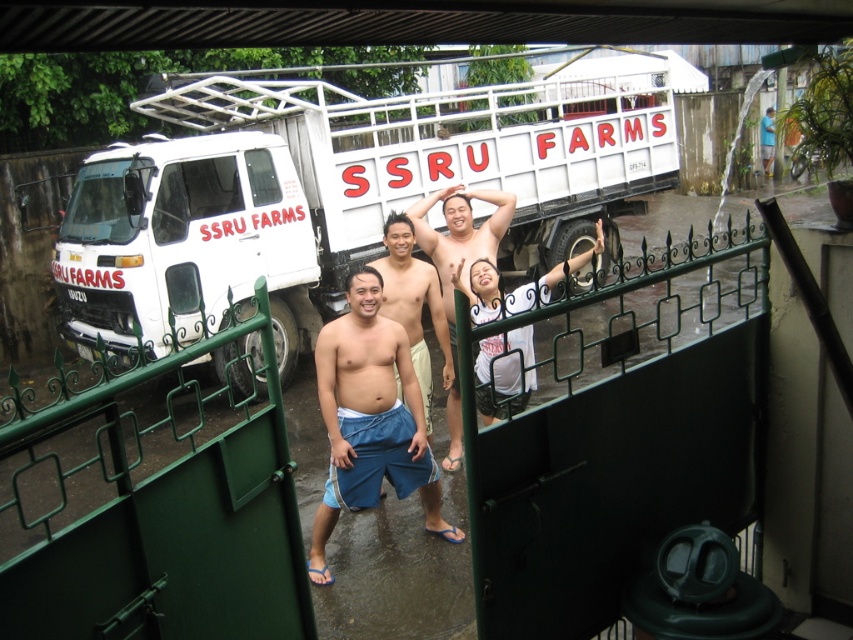
From the picture: Between white matte truck at upper center and white cotton shirt at center, which one appears on the left side from the viewer's perspective?

Positioned to the left is white cotton shirt at center.

The width and height of the screenshot is (853, 640). What are the coordinates of `white matte truck at upper center` in the screenshot? It's located at (341, 186).

Which is above, shiny metallic shirt at center or green fabric shirt at center?

Positioned higher is green fabric shirt at center.

Is point (453, 428) closer to viewer compared to point (769, 152)?

Yes, it is in front of point (769, 152).

I want to click on shiny metallic shirt at center, so click(454, 268).

What do you see at coordinates (370, 419) in the screenshot? I see `blue cotton shorts at center` at bounding box center [370, 419].

The image size is (853, 640). In order to click on blue cotton shorts at center in this screenshot , I will do [x=370, y=419].